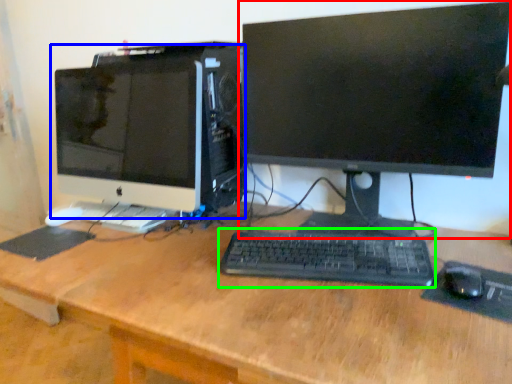
Question: Which object is positioned closest to computer monitor (highlighted by a red box)? Select from computer monitor (highlighted by a blue box) and computer keyboard (highlighted by a green box).

Choices:
 (A) computer monitor
 (B) computer keyboard

Answer: (B)